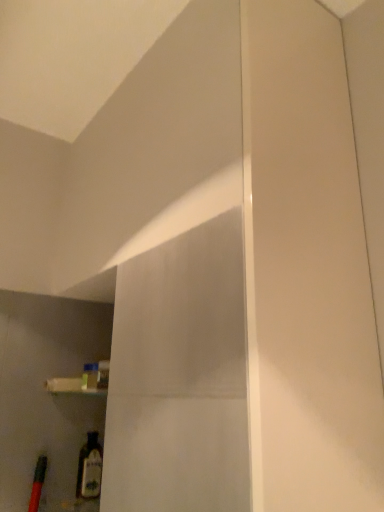
The width and height of the screenshot is (384, 512). Describe the element at coordinates (90, 468) in the screenshot. I see `translucent glass bottle at lower left` at that location.

Where is `translucent glass bottle at lower left`? Image resolution: width=384 pixels, height=512 pixels. translucent glass bottle at lower left is located at coordinates (x=90, y=468).

In order to click on translucent glass bottle at lower left in this screenshot , I will do `click(90, 468)`.